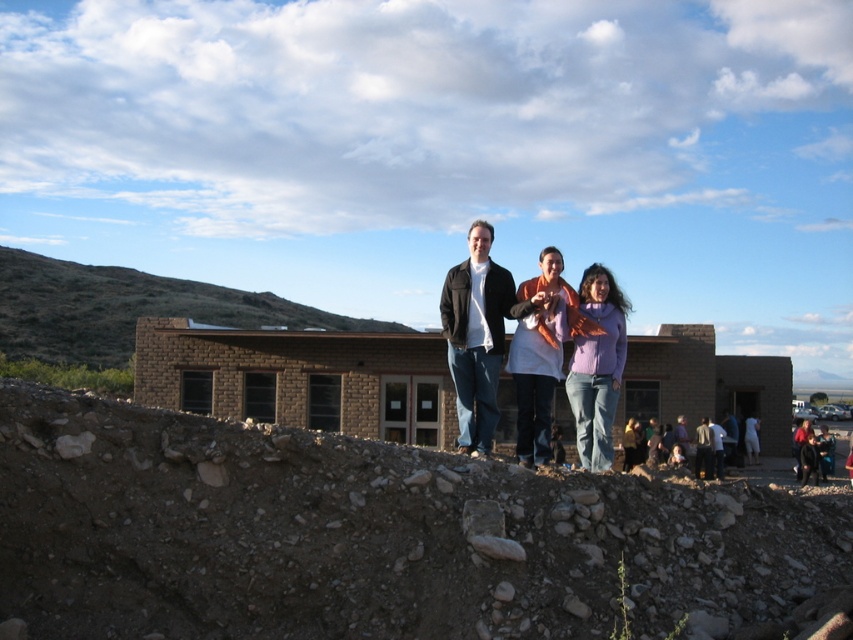
You are a photographer at the construction site and want to capture both the orange scarf at center and the black leather jacket at center in the same frame. Which object should you position closer to the left side of your camera viewfinder to include both?

To include both the orange scarf at center and the black leather jacket at center in the same frame, position the orange scarf at center closer to the left side of your camera viewfinder since it is already located to the left of the black leather jacket at center.

Based on the photo, you are standing at the construction site in front of the brick building. You notice two points marked on the ground. The first point is at coordinates point (497,355), and the second point is at point (697,460). Which point is closer to your current position?

Point (497,355) is closer to the camera than point (697,460), so the first point is closer to your current position.

You are a photographer trying to capture a group photo of the matte black jacket at center and the dark gray shirt at center. To ensure both subjects are in frame, should you position yourself to the left or right of the group?

You should position yourself to the right of the group because the matte black jacket at center is to the left of dark gray shirt at center. This way, both subjects will be visible in the frame when facing towards your right side.